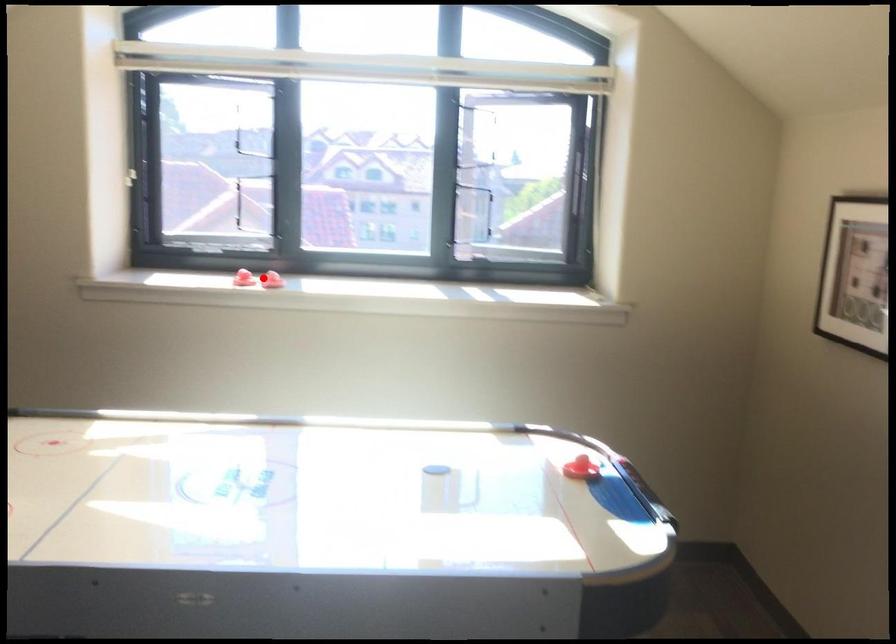
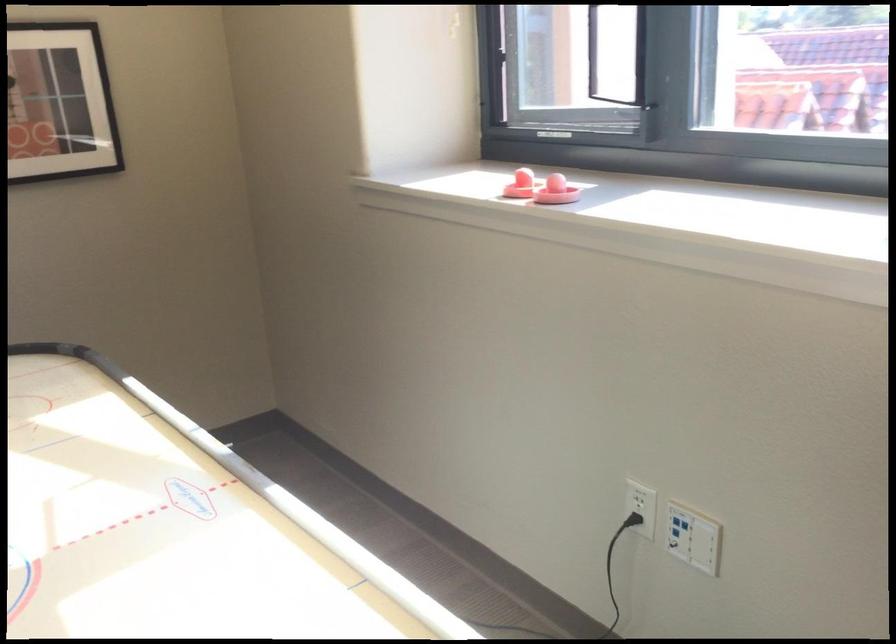
The point at the highlighted location is marked in the first image. Where is the corresponding point in the second image?

(556, 191)